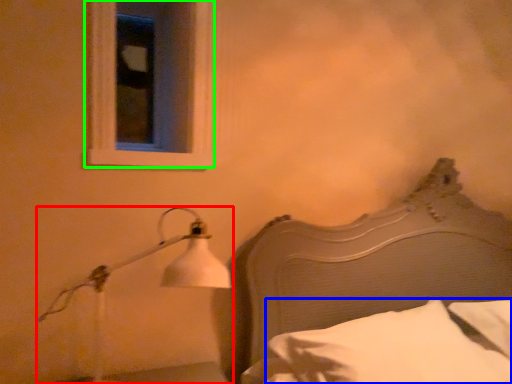
Question: Which object is positioned closest to lamp (highlighted by a red box)? Select from pillow (highlighted by a blue box) and window (highlighted by a green box).

Choices:
 (A) pillow
 (B) window

Answer: (B)